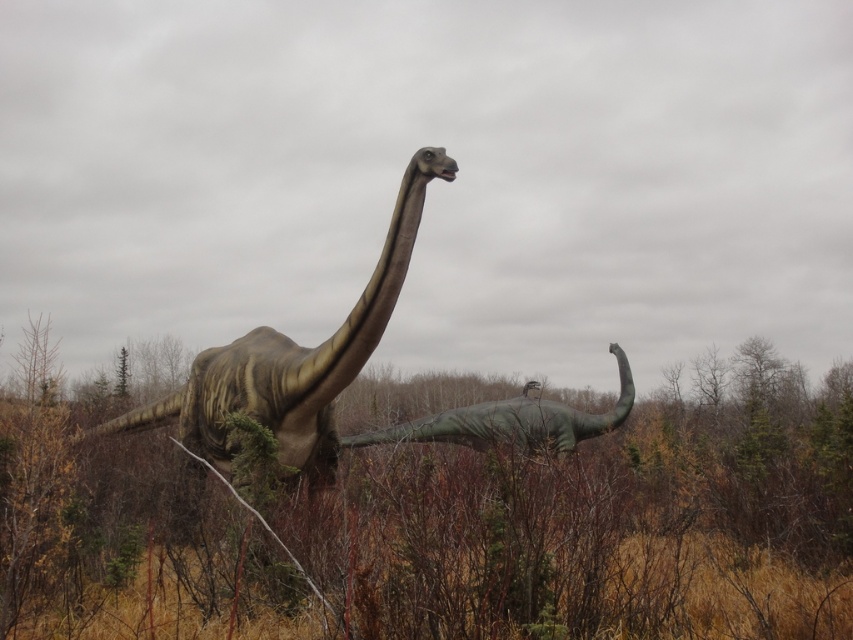
Question: Does green matte foliage at center have a smaller size compared to greenish-brown textured dinosaur at center?

Choices:
 (A) no
 (B) yes

Answer: (A)

Question: Estimate the real-world distances between objects in this image. Which object is closer to the green matte foliage at center?

Choices:
 (A) greenish-brown textured dinosaur at center
 (B) green matte dinosaur at center

Answer: (A)

Question: Which point is closer to the camera?

Choices:
 (A) green matte foliage at center
 (B) greenish-brown textured dinosaur at center

Answer: (A)

Question: Is green matte foliage at center to the left of green matte dinosaur at center from the viewer's perspective?

Choices:
 (A) no
 (B) yes

Answer: (B)

Question: In this image, where is green matte foliage at center located relative to green matte dinosaur at center?

Choices:
 (A) above
 (B) below

Answer: (B)

Question: Which is farther from the green matte dinosaur at center?

Choices:
 (A) greenish-brown textured dinosaur at center
 (B) green matte foliage at center

Answer: (B)